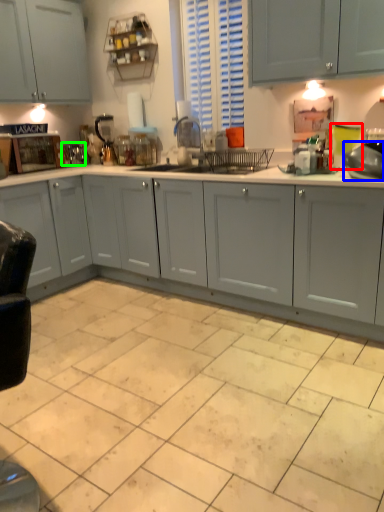
Question: Estimate the real-world distances between objects in this image. Which object is closer to teal (highlighted by a red box), appliance (highlighted by a blue box) or appliance (highlighted by a green box)?

Choices:
 (A) appliance
 (B) appliance

Answer: (A)